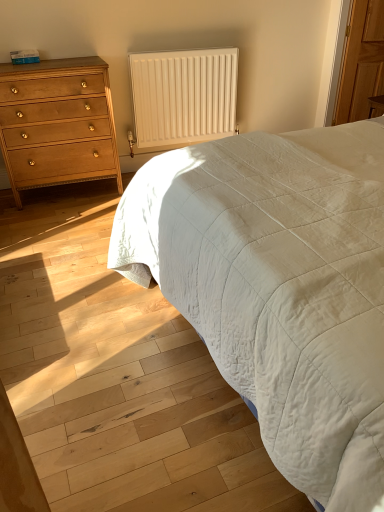
In order to face wooden armoire at right, should I rotate leftwards or rightwards?

You should rotate right by 23.006 degrees.

In order to click on white quilted fabric at center in this screenshot , I will do `click(278, 286)`.

What is the approximate width of matte wood chest of drawers at left?

The width of matte wood chest of drawers at left is 19.84 inches.

Locate an element on the screen. matte wood chest of drawers at left is located at coordinates (57, 123).

At what (x,y) coordinates should I click in order to perform the action: click on white matte radiator at upper center. Please return your answer as a coordinate pair (x, y). The height and width of the screenshot is (512, 384). Looking at the image, I should click on (183, 96).

Considering the positions of objects wooden armoire at right and white quilted fabric at center in the image provided, who is more to the left, wooden armoire at right or white quilted fabric at center?

white quilted fabric at center is more to the left.

Are wooden armoire at right and white quilted fabric at center located far from each other?

That's right, there is a large distance between wooden armoire at right and white quilted fabric at center.

Is point (371, 30) farther from viewer compared to point (188, 246)?

Yes, it is behind point (188, 246).

Could you tell me if wooden armoire at right is turned towards white matte radiator at upper center?

No, wooden armoire at right does not turn towards white matte radiator at upper center.

Can you tell me how much wooden armoire at right and white matte radiator at upper center differ in facing direction?

11.7 degrees.

The image size is (384, 512). I want to click on radiator below the wooden armoire at right (from the image's perspective), so click(183, 96).

Is the depth of wooden armoire at right less than that of white matte radiator at upper center?

No, it is behind white matte radiator at upper center.

Based on their sizes in the image, would you say white matte radiator at upper center is bigger or smaller than white quilted fabric at center?

Clearly, white matte radiator at upper center is smaller in size than white quilted fabric at center.

Can you tell me how much white matte radiator at upper center and white quilted fabric at center differ in facing direction?

86.2 degrees.

Considering the sizes of objects white matte radiator at upper center and white quilted fabric at center in the image provided, who is shorter, white matte radiator at upper center or white quilted fabric at center?

Standing shorter between the two is white quilted fabric at center.

Considering the relative sizes of wooden armoire at right and matte wood chest of drawers at left in the image provided, is wooden armoire at right bigger than matte wood chest of drawers at left?

No, wooden armoire at right is not bigger than matte wood chest of drawers at left.

Is wooden armoire at right far away from matte wood chest of drawers at left?

Yes, wooden armoire at right and matte wood chest of drawers at left are quite far apart.

What are the coordinates of `armoire that is above the matte wood chest of drawers at left (from the image's perspective)` in the screenshot? It's located at (361, 62).

Is wooden armoire at right facing towards matte wood chest of drawers at left?

No, wooden armoire at right is not aimed at matte wood chest of drawers at left.

Between matte wood chest of drawers at left and wooden armoire at right, which one has more height?

wooden armoire at right is taller.

Is matte wood chest of drawers at left positioned with its back to wooden armoire at right?

No, matte wood chest of drawers at left's orientation is not away from wooden armoire at right.

Locate an element on the screen. The height and width of the screenshot is (512, 384). armoire behind the matte wood chest of drawers at left is located at coordinates click(361, 62).

From the image's perspective, between matte wood chest of drawers at left and wooden armoire at right, who is located below?

matte wood chest of drawers at left, from the image's perspective.

From the image's perspective, which is below, white matte radiator at upper center or wooden armoire at right?

white matte radiator at upper center is shown below in the image.

Would you say white matte radiator at upper center contains wooden armoire at right?

Actually, wooden armoire at right is outside white matte radiator at upper center.

Considering the sizes of objects white matte radiator at upper center and wooden armoire at right in the image provided, who is thinner, white matte radiator at upper center or wooden armoire at right?

Thinner between the two is wooden armoire at right.

I want to click on armoire behind the white matte radiator at upper center, so point(361,62).

Looking at this image, is white matte radiator at upper center oriented towards matte wood chest of drawers at left?

No, white matte radiator at upper center is not oriented towards matte wood chest of drawers at left.

Is white matte radiator at upper center inside the boundaries of matte wood chest of drawers at left, or outside?

white matte radiator at upper center cannot be found inside matte wood chest of drawers at left.

What's the angular difference between white matte radiator at upper center and matte wood chest of drawers at left's facing directions?

There is a 0.0541-degree angle between the facing directions of white matte radiator at upper center and matte wood chest of drawers at left.

Which object is wider, white matte radiator at upper center or matte wood chest of drawers at left?

matte wood chest of drawers at left is wider.

Identify the location of bed in front of the wooden armoire at right. (278, 286).

At what (x,y) coordinates should I click in order to perform the action: click on armoire above the white matte radiator at upper center (from a real-world perspective). Please return your answer as a coordinate pair (x, y). The image size is (384, 512). Looking at the image, I should click on (361, 62).

From the image, which object appears to be nearer to white quilted fabric at center, matte wood chest of drawers at left or wooden armoire at right?

The object closer to white quilted fabric at center is matte wood chest of drawers at left.

Based on their spatial positions, is white matte radiator at upper center or white quilted fabric at center further from wooden armoire at right?

Based on the image, white quilted fabric at center appears to be further to wooden armoire at right.

Estimate the real-world distances between objects in this image. Which object is further from matte wood chest of drawers at left, white quilted fabric at center or wooden armoire at right?

The object further to matte wood chest of drawers at left is wooden armoire at right.

In the scene shown: Which object lies further to the anchor point wooden armoire at right, white quilted fabric at center or matte wood chest of drawers at left?

white quilted fabric at center lies further to wooden armoire at right than the other object.

Estimate the real-world distances between objects in this image. Which object is closer to white matte radiator at upper center, matte wood chest of drawers at left or white quilted fabric at center?

The object closer to white matte radiator at upper center is matte wood chest of drawers at left.

When comparing their distances from white matte radiator at upper center, does wooden armoire at right or matte wood chest of drawers at left seem closer?

matte wood chest of drawers at left.

Looking at this image, which object lies further to the anchor point white quilted fabric at center, wooden armoire at right or matte wood chest of drawers at left?

Among the two, wooden armoire at right is located further to white quilted fabric at center.

From the image, which object appears to be nearer to matte wood chest of drawers at left, white matte radiator at upper center or wooden armoire at right?

white matte radiator at upper center.

Locate an element on the screen. The image size is (384, 512). chest of drawers between white quilted fabric at center and wooden armoire at right along the z-axis is located at coordinates (57, 123).

Where is `chest of drawers between white quilted fabric at center and white matte radiator at upper center from front to back`? This screenshot has width=384, height=512. chest of drawers between white quilted fabric at center and white matte radiator at upper center from front to back is located at coordinates [57, 123].

Find the location of a particular element. radiator located between matte wood chest of drawers at left and wooden armoire at right in the left-right direction is located at coordinates [183, 96].

Where is `radiator located between white quilted fabric at center and wooden armoire at right in the depth direction`? The image size is (384, 512). radiator located between white quilted fabric at center and wooden armoire at right in the depth direction is located at coordinates (183, 96).